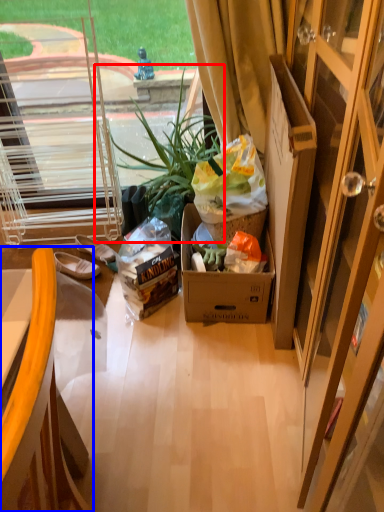
Question: Among these objects, which one is farthest to the camera, houseplant (highlighted by a red box) or chair (highlighted by a blue box)?

Choices:
 (A) houseplant
 (B) chair

Answer: (A)